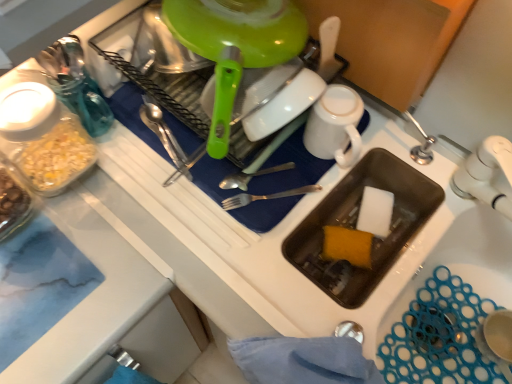
The image size is (512, 384). I want to click on vacant area that is situated to the right of white matte mug at upper center, so tap(408, 153).